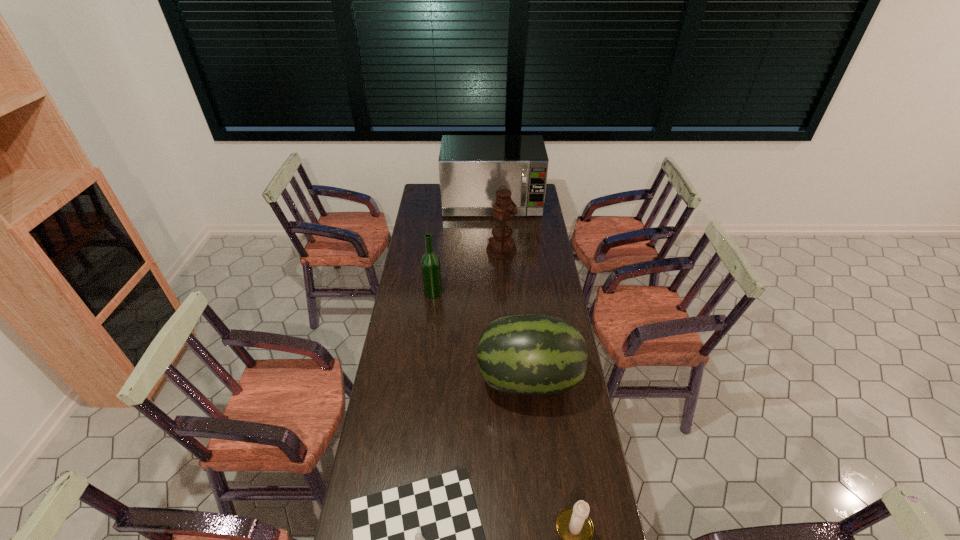
Where is `the farthest object`? This screenshot has height=540, width=960. the farthest object is located at coordinates (472, 168).

Where is `the second farthest object`? The height and width of the screenshot is (540, 960). the second farthest object is located at coordinates (501, 246).

The width and height of the screenshot is (960, 540). In order to click on alcohol in this screenshot , I will do `click(430, 263)`.

You are a GUI agent. You are given a task and a screenshot of the screen. Output one action in this format:
    pyautogui.click(x=<x>, y=<y>)
    Task: Click on the watermelon
    This screenshot has height=540, width=960.
    Given the screenshot: What is the action you would take?
    pyautogui.click(x=527, y=355)

Image resolution: width=960 pixels, height=540 pixels. I want to click on vacant space located with the door open on the microwave oven, so click(494, 257).

Find the location of a particular element. free spot located on the front of the second farthest object is located at coordinates (505, 303).

Image resolution: width=960 pixels, height=540 pixels. What are the coordinates of `vacant area situated 0.130m on the right of the third farthest object` in the screenshot? It's located at (470, 292).

Find the location of a particular element. This screenshot has height=540, width=960. free space located on the front of the watermelon is located at coordinates (544, 535).

You are a GUI agent. You are given a task and a screenshot of the screen. Output one action in this format:
    pyautogui.click(x=<x>, y=<y>)
    Task: Click on the object that is at the far edge
    This screenshot has width=960, height=540.
    Given the screenshot: What is the action you would take?
    pyautogui.click(x=472, y=168)

Identify the location of microwave oven that is positioned at the left edge. The width and height of the screenshot is (960, 540). (472, 168).